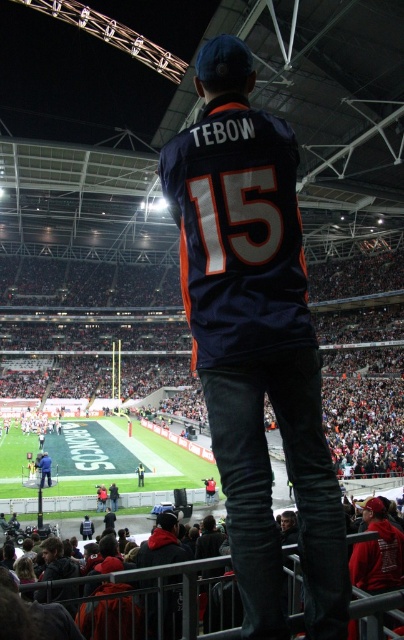
In the scene shown: You are a photographer at the stadium and want to capture a photo of the dark blue jersey at center. The stadium has a rule that you can only take photos from the point at coordinates (162, 544). Can you take a clear photo of the dark blue jersey at center from this position?

The dark blue jersey at center is located at point (162, 544), so yes, you can take a clear photo of the dark blue jersey at center from this position since you are exactly at its location.